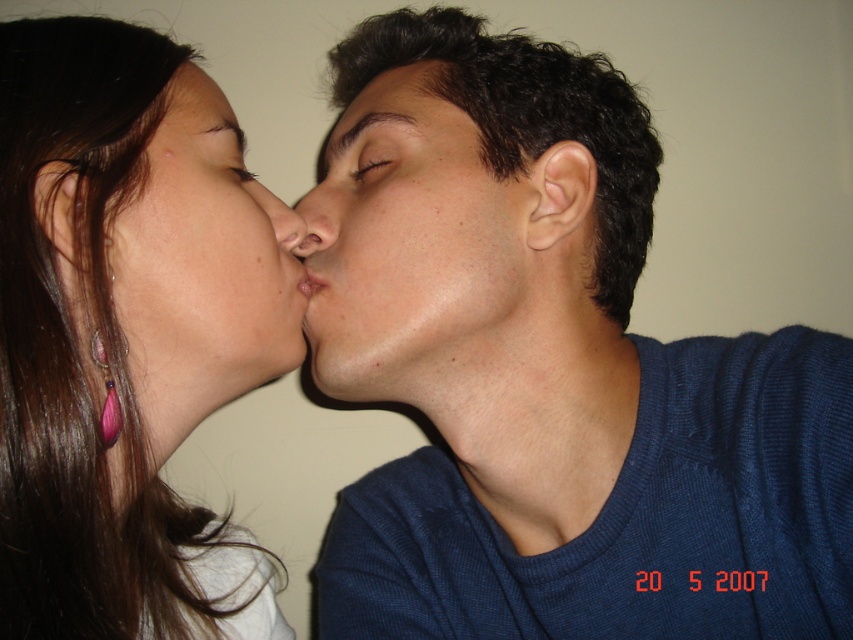
Question: Which point is farther to the camera?

Choices:
 (A) (254, 186)
 (B) (335, 204)

Answer: (B)

Question: Can you confirm if smooth skin nose at center is smaller than matte skin nose at center?

Choices:
 (A) no
 (B) yes

Answer: (A)

Question: Which object is the closest to the smooth skin face at upper left?

Choices:
 (A) matte skin nose at center
 (B) matte blue sweater at right
 (C) matte skin face at center

Answer: (C)

Question: Does matte skin face at center appear on the right side of matte skin nose at center?

Choices:
 (A) no
 (B) yes

Answer: (A)

Question: Can you confirm if matte skin face at center is positioned to the right of matte skin nose at center?

Choices:
 (A) yes
 (B) no

Answer: (B)

Question: Estimate the real-world distances between objects in this image. Which object is closer to the matte blue sweater at right?

Choices:
 (A) matte skin nose at center
 (B) smooth skin nose at center
 (C) matte skin face at center
 (D) smooth skin face at center

Answer: (D)